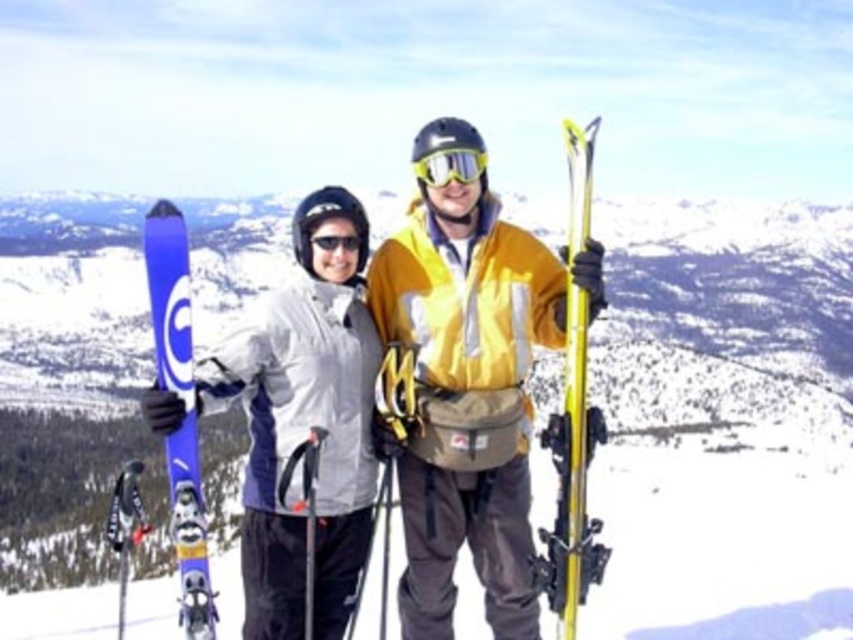
You are planning to carry both the matte blue snowboard at left and the yellow metallic ski at right in a backpack. Given their widths, which one will require more space horizontally in the backpack?

The matte blue snowboard at left requires more horizontal space in the backpack since its width surpasses that of the yellow metallic ski at right.

You are standing on the snowy mountain peak and see two points marked in the scene. Which point is closer to you, point (460, 262) or point (572, 486)?

Point (460, 262) is closer to you because it is further to the viewer than point (572, 486).

You are a ski equipment inspector checking the dimensions of the skis in the image. Which of the two skis, the matte blue skis at center or the yellow metallic ski at right, is shorter in height?

The matte blue skis at center is not as tall as yellow metallic ski at right, so the matte blue skis at center is shorter in height.